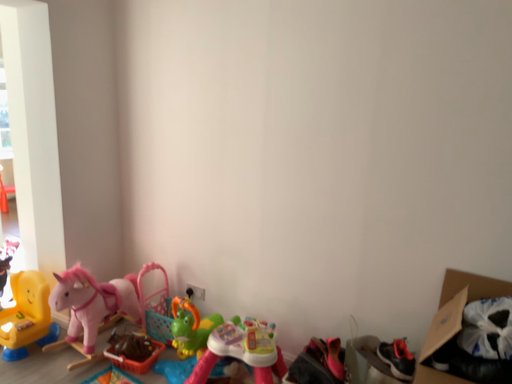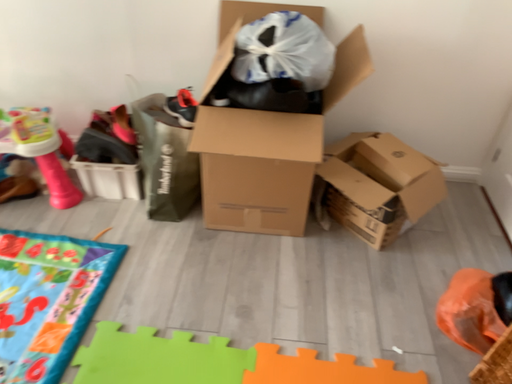
Question: How did the camera likely rotate when shooting the video?

Choices:
 (A) rotated left
 (B) rotated right

Answer: (B)